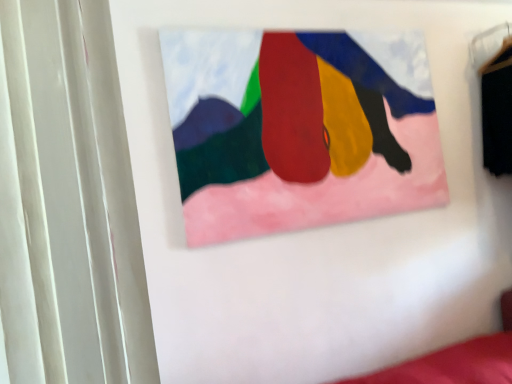
What do you see at coordinates (298, 129) in the screenshot?
I see `matte canvas painting at center` at bounding box center [298, 129].

What is the approximate width of matte canvas painting at center?

The width of matte canvas painting at center is 1.91 inches.

Locate an element on the screen. The width and height of the screenshot is (512, 384). matte canvas painting at center is located at coordinates (298, 129).

I want to click on matte canvas painting at center, so click(298, 129).